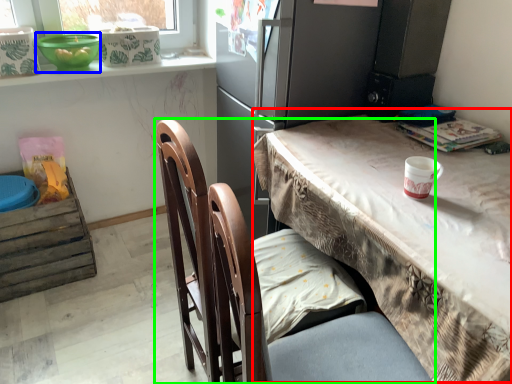
Question: Based on their relative distances, which object is farther from table (highlighted by a red box)? Choose from bowl (highlighted by a blue box) and chair (highlighted by a green box).

Choices:
 (A) bowl
 (B) chair

Answer: (A)